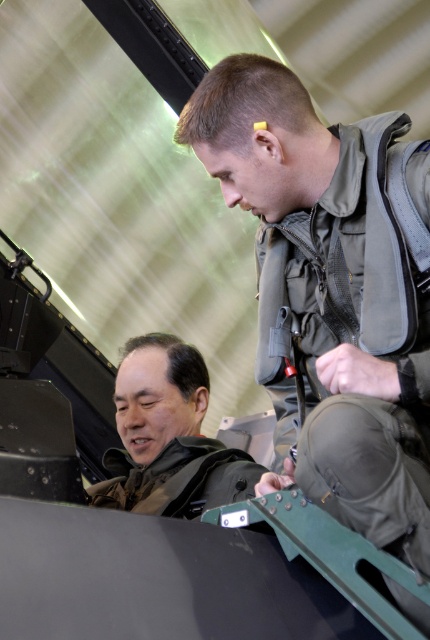
Who is more distant from viewer, (x=349, y=376) or (x=150, y=442)?

Positioned behind is point (x=150, y=442).

Does matte green uniform at center appear over brown leather jacket at lower left?

Yes.

Between point (414, 173) and point (151, 368), which one is positioned behind?

Positioned behind is point (151, 368).

Locate an element on the screen. Image resolution: width=430 pixels, height=640 pixels. matte green uniform at center is located at coordinates (328, 296).